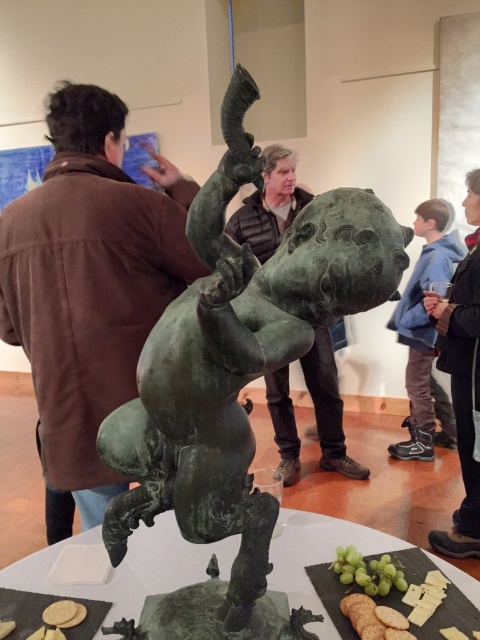
Locate an element on the screen. This screenshot has width=480, height=640. bronze statue at center is located at coordinates (269, 204).

Which is below, bronze statue at center or green matte grapes at lower center?

Positioned lower is green matte grapes at lower center.

Measure the distance between bronze statue at center and camera.

The distance of bronze statue at center from camera is 9.17 feet.

The height and width of the screenshot is (640, 480). What are the coordinates of `bronze statue at center` in the screenshot? It's located at (269, 204).

Does point (466, 292) lie in front of point (431, 225)?

Yes, it is in front of point (431, 225).

Who is shorter, blue denim jacket at right or blue denim jacket at upper right?

blue denim jacket at upper right

Is point (470, 278) behind point (452, 422)?

No.

Locate an element on the screen. The height and width of the screenshot is (640, 480). blue denim jacket at right is located at coordinates (462, 376).

Does brown leather jacket at upper left have a smaller size compared to green marble table at center?

Actually, brown leather jacket at upper left might be larger than green marble table at center.

Does brown leather jacket at upper left have a lesser width compared to green marble table at center?

Yes.

Who is more forward, (x=126, y=285) or (x=304, y=529)?

Point (x=304, y=529)

Locate an element on the screen. The width and height of the screenshot is (480, 640). brown leather jacket at upper left is located at coordinates (88, 289).